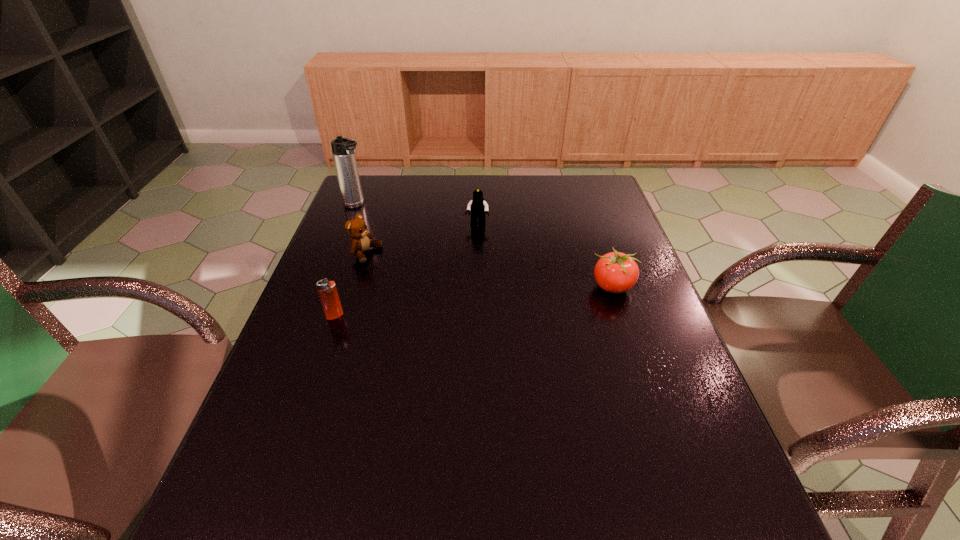
In order to click on igniter at the left edge in this screenshot , I will do `click(327, 290)`.

At what (x,y) coordinates should I click in order to perform the action: click on teddy bear that is at the left edge. Please return your answer as a coordinate pair (x, y). The image size is (960, 540). Looking at the image, I should click on [x=356, y=228].

Where is `thermos bottle positioned at the left edge`? The width and height of the screenshot is (960, 540). thermos bottle positioned at the left edge is located at coordinates (343, 149).

This screenshot has width=960, height=540. In order to click on object at the right edge in this screenshot , I will do `click(615, 272)`.

Identify the location of object that is at the far left corner. (343, 149).

At what (x,y) coordinates should I click in order to perform the action: click on vacant region at the far edge of the desktop. Please return your answer as a coordinate pair (x, y). The image size is (960, 540). Looking at the image, I should click on (429, 187).

This screenshot has height=540, width=960. In the image, there is a desktop. Find the location of `free space at the near edge`. free space at the near edge is located at coordinates (628, 442).

Identify the location of vacant area at the left edge of the desktop. This screenshot has height=540, width=960. (326, 329).

Identify the location of vacant area at the right edge. The image size is (960, 540). coord(640,323).

In the image, there is a desktop. Identify the location of vacant space at the far right corner. (568, 194).